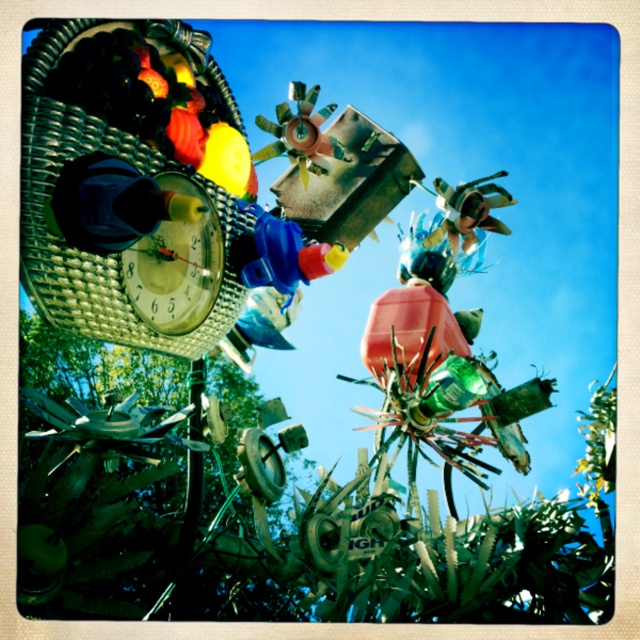
Who is more distant from viewer, (179, 317) or (269, 282)?

Positioned behind is point (269, 282).

Is point (170, 282) more distant than point (268, 246)?

No, it is not.

Find the location of a particular element. metallic clock at upper left is located at coordinates (177, 264).

Locate an element on the screen. metallic clock at upper left is located at coordinates (177, 264).

Between blue plastic toy at center and metallic windmill at center, which one appears on the right side from the viewer's perspective?

From the viewer's perspective, blue plastic toy at center appears more on the right side.

Is blue plastic toy at center shorter than metallic windmill at center?

Yes, blue plastic toy at center is shorter than metallic windmill at center.

Is point (280, 232) farther from camera compared to point (307, 136)?

No, (280, 232) is in front of (307, 136).

Where is `blue plastic toy at center`? Image resolution: width=640 pixels, height=640 pixels. blue plastic toy at center is located at coordinates (285, 253).

Who is positioned more to the left, metallic woven basket at upper left or metallic windmill at center?

From the viewer's perspective, metallic woven basket at upper left appears more on the left side.

Is metallic woven basket at upper left bigger than metallic windmill at center?

Yes, metallic woven basket at upper left is bigger than metallic windmill at center.

Is point (150, 264) closer to camera compared to point (340, 147)?

Yes, it is in front of point (340, 147).

Where is `metallic woven basket at upper left`? The height and width of the screenshot is (640, 640). metallic woven basket at upper left is located at coordinates (131, 184).